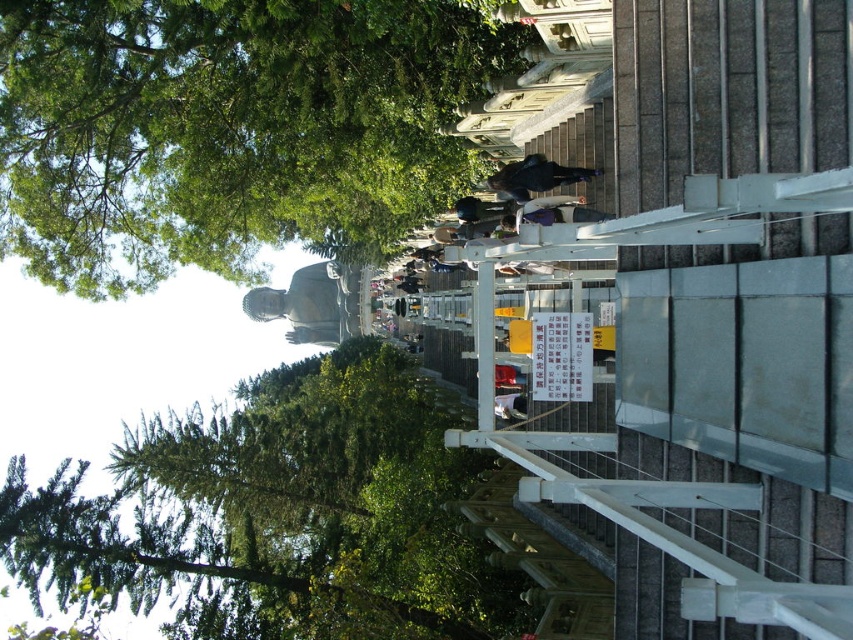
Question: Is matte gray statue at center in front of dark blue jeans at center?

Choices:
 (A) no
 (B) yes

Answer: (A)

Question: From the image, what is the correct spatial relationship of green leafy tree at lower left in relation to dark blue jeans at center?

Choices:
 (A) above
 (B) below

Answer: (B)

Question: Which object is the closest to the matte gray statue at center?

Choices:
 (A) green leafy tree at upper left
 (B) green leafy tree at lower left

Answer: (B)

Question: Which object appears closest to the camera in this image?

Choices:
 (A) matte gray statue at center
 (B) green leafy tree at upper left

Answer: (B)

Question: Which point is farther from the camera taking this photo?

Choices:
 (A) (383, 22)
 (B) (293, 314)
 (C) (521, 196)
 (D) (424, 630)

Answer: (B)

Question: Is green leafy tree at lower left below dark blue jeans at center?

Choices:
 (A) no
 (B) yes

Answer: (B)